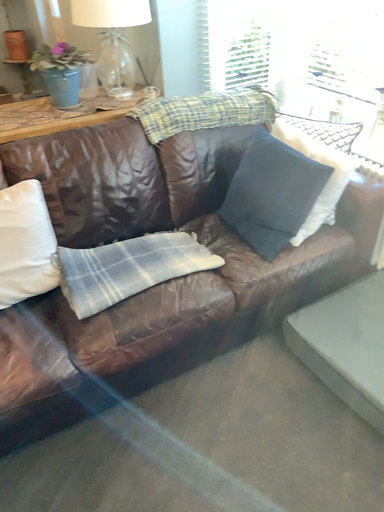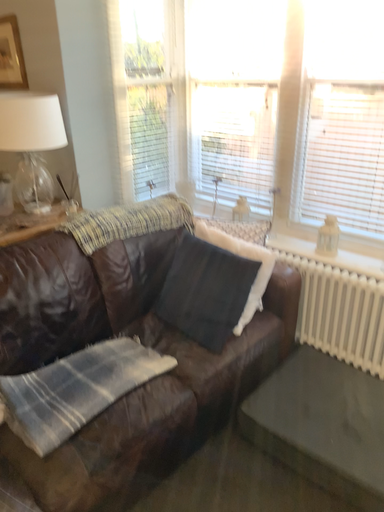
Question: Which way did the camera rotate in the video?

Choices:
 (A) rotated left
 (B) rotated right

Answer: (B)